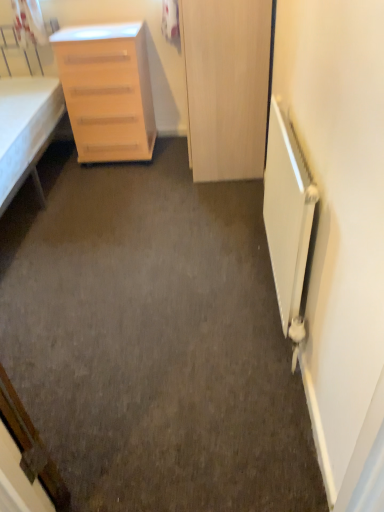
Image resolution: width=384 pixels, height=512 pixels. I want to click on vacant area that lies between light wood/finely finished chest of drawers at left and white matte radiator at right, so click(177, 219).